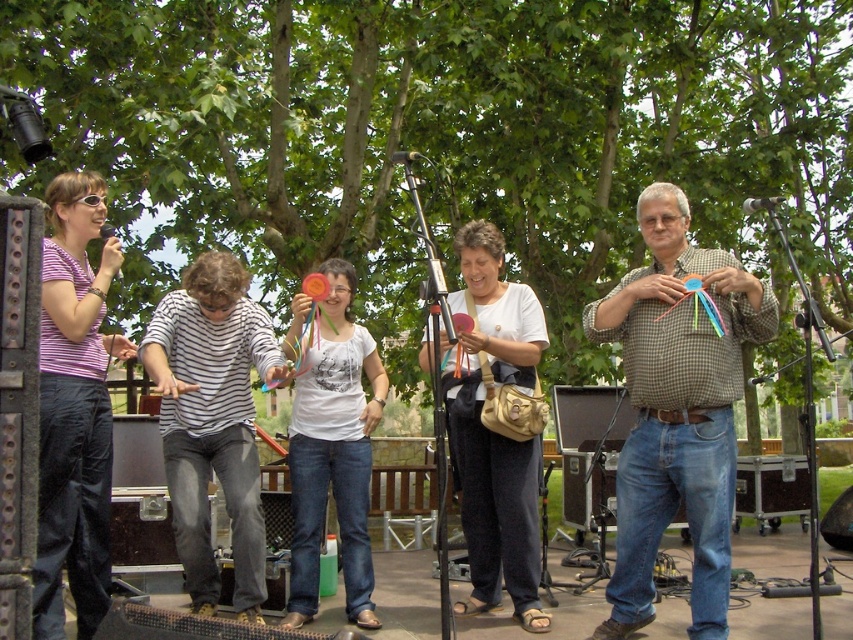
You are organizing a photoshoot and need to ensure that the matte purple shirt at center and the white fabric purse at center are both visible in the frame. Given their sizes, which object might require more careful positioning to avoid being overshadowed?

The matte purple shirt at center has a smaller size compared to the white fabric purse at center, so it might require more careful positioning to avoid being overshadowed.

Consider the image. You are a photographer trying to capture a photo of the checkered shirt at center and striped shirt at center. Based on their positions, which one should you focus on first to ensure both are in frame?

The checkered shirt at center is above the striped shirt at center, so you should focus on the checkered shirt at center first to ensure both are in frame.

You are a photographer trying to capture a clear photo of the matte purple shirt at center and the white fabric purse at center. Which object should you focus on first to ensure both are in focus?

The matte purple shirt at center is in front of the white fabric purse at center. To ensure both are in focus, you should focus on the matte purple shirt at center first since it is closer to the camera.